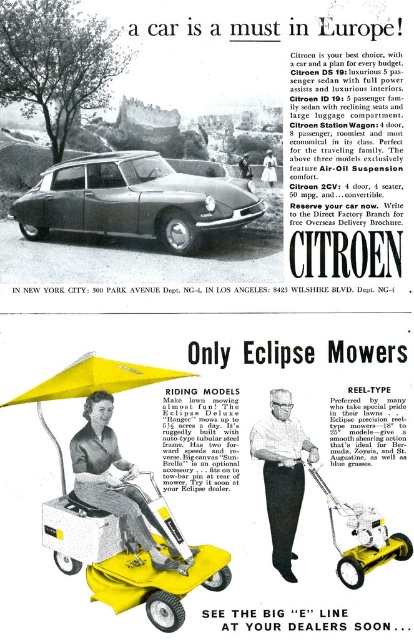
You are a customer looking to purchase a riding mower and a canopy for your garden. You see both items displayed in the advertisement. Which one is bigger in size between the yellow fabric riding mower at lower left and the yellow fabric canopy at lower left?

The yellow fabric riding mower at lower left has a larger size compared to the yellow fabric canopy at lower left, so the riding mower is bigger.

You are a photographer setting up equipment in the vintage Citroen advertisement scene. You need to place a small tripod between the matte silver car at center and the yellow fabric riding mower at lower left. Based on their sizes, which object should the tripod be closer to?

The matte silver car at center is smaller than the yellow fabric riding mower at lower left, so the tripod should be placed closer to the matte silver car at center to maintain a balanced composition.